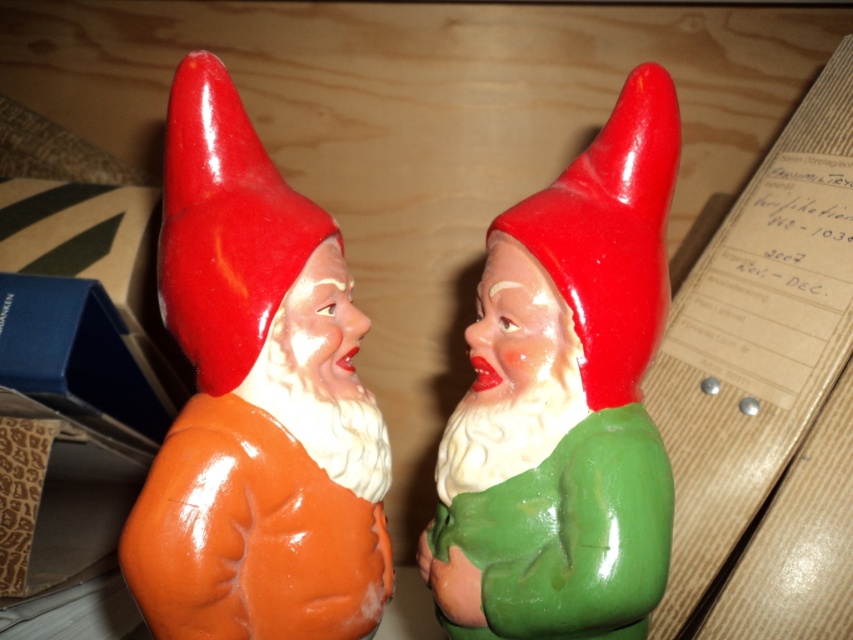
Is matte orange statue at left to the right of green glossy gnome at center from the viewer's perspective?

Incorrect, matte orange statue at left is not on the right side of green glossy gnome at center.

Find the location of a particular element. This screenshot has width=853, height=640. matte orange statue at left is located at coordinates (256, 401).